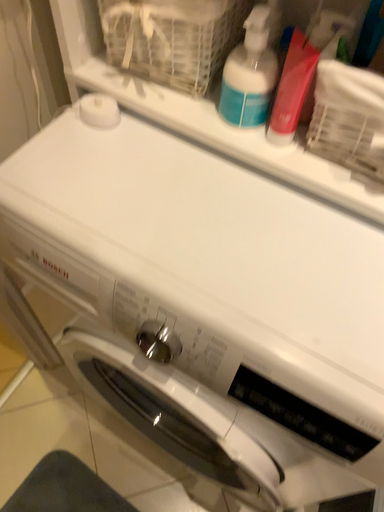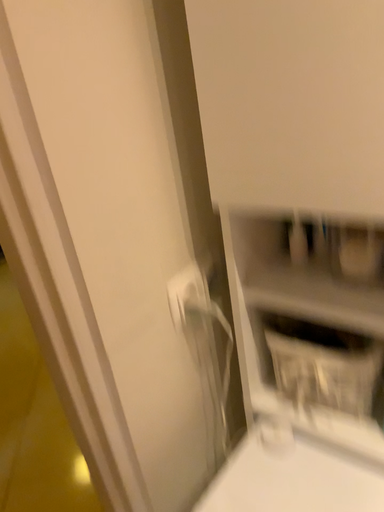
Question: How did the camera likely rotate when shooting the video?

Choices:
 (A) rotated downward
 (B) rotated upward

Answer: (B)